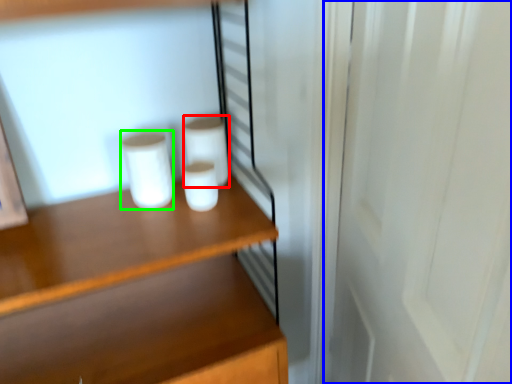
Question: Based on their relative distances, which object is farther from paper towel (highlighted by a red box)? Choose from screen door (highlighted by a blue box) and paper towel (highlighted by a green box).

Choices:
 (A) screen door
 (B) paper towel

Answer: (A)